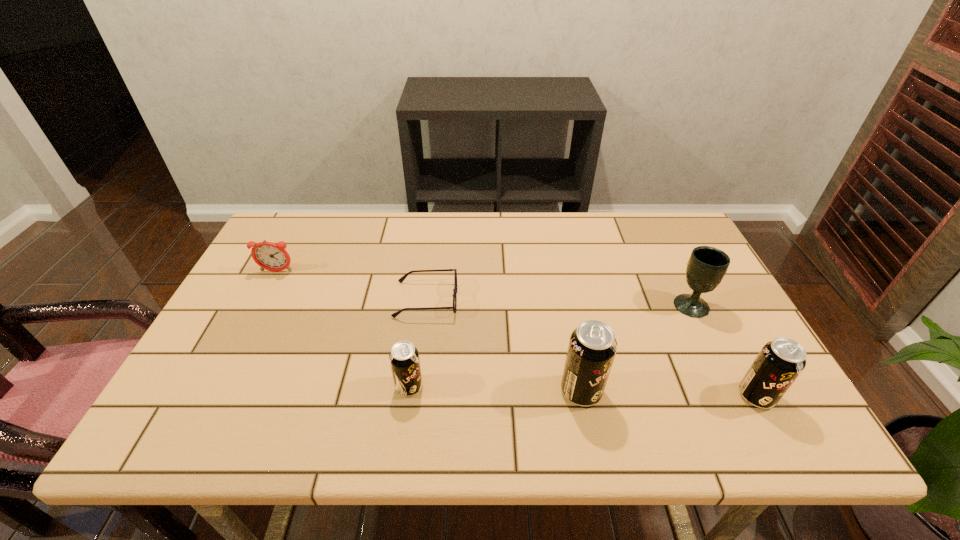
At what (x,y) coordinates should I click in order to perform the action: click on free space for a new soda can on the left. Please return your answer as a coordinate pair (x, y). This screenshot has height=540, width=960. Looking at the image, I should click on (241, 382).